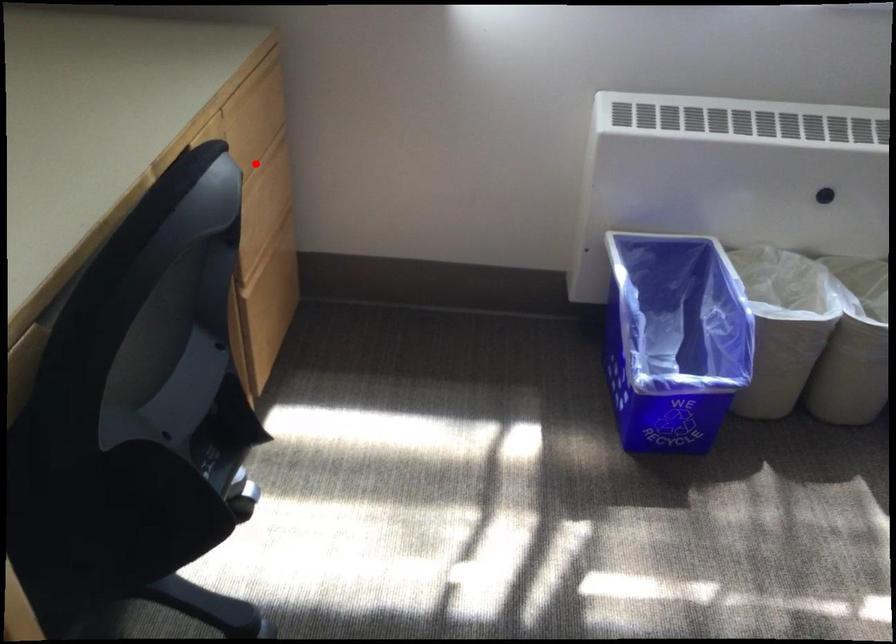
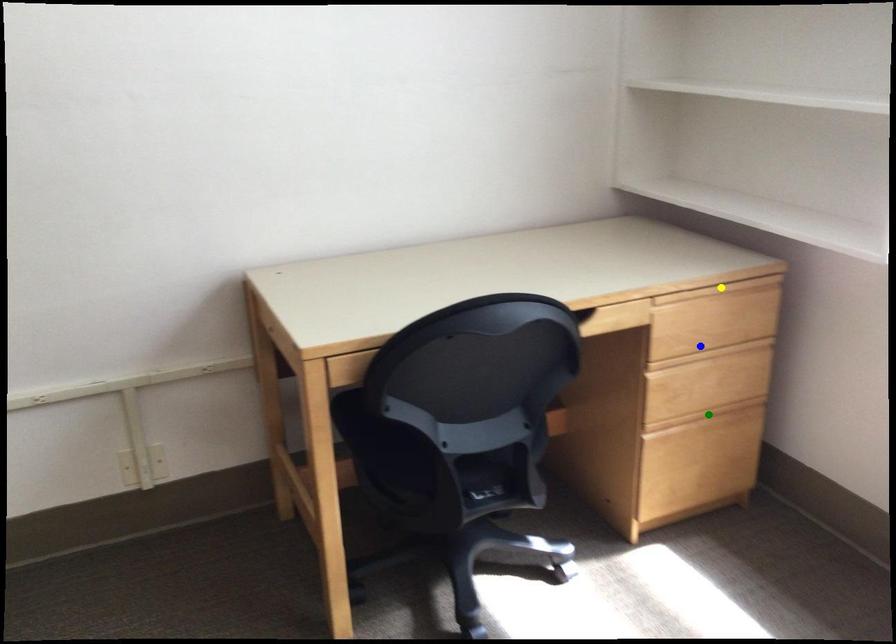
Question: I am providing you with two images of the same scene from different viewpoints. A red point is marked on the first image. You are given multiple points on the second image. Which spot in image 2 lines up with the point in image 1?

Choices:
 (A) yellow point
 (B) blue point
 (C) green point

Answer: (B)